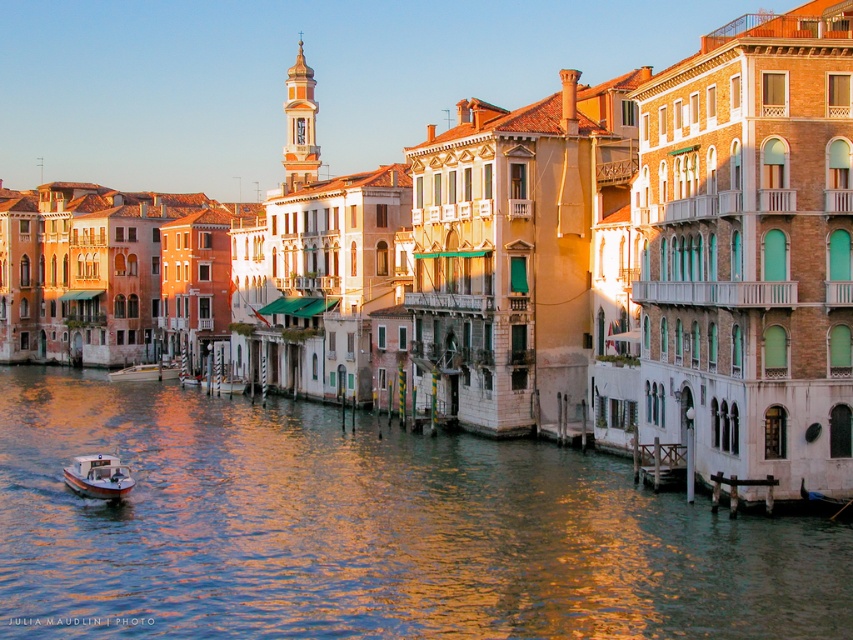
Between white plastic boat at lower left and wooden boat at center, which one appears on the left side from the viewer's perspective?

Positioned to the left is wooden boat at center.

Is white plastic boat at lower left bigger than wooden boat at center?

Incorrect, white plastic boat at lower left is not larger than wooden boat at center.

The height and width of the screenshot is (640, 853). I want to click on white plastic boat at lower left, so click(x=97, y=476).

The width and height of the screenshot is (853, 640). Identify the location of white plastic boat at lower left. (97, 476).

Which is behind, point (555, 586) or point (142, 380)?

Point (142, 380)

From the picture: Who is more forward, (352,529) or (154,378)?

Point (352,529)

Does point (247, 452) come closer to viewer compared to point (117, 378)?

Yes, it is.

At what (x,y) coordinates should I click in order to perform the action: click on shiny golden water at center. Please return your answer as a coordinate pair (x, y). Looking at the image, I should click on (369, 531).

Who is positioned more to the right, shiny golden water at center or white plastic boat at lower left?

From the viewer's perspective, shiny golden water at center appears more on the right side.

Which is more to the left, shiny golden water at center or white plastic boat at lower left?

Positioned to the left is white plastic boat at lower left.

Identify the location of shiny golden water at center. The width and height of the screenshot is (853, 640). (369, 531).